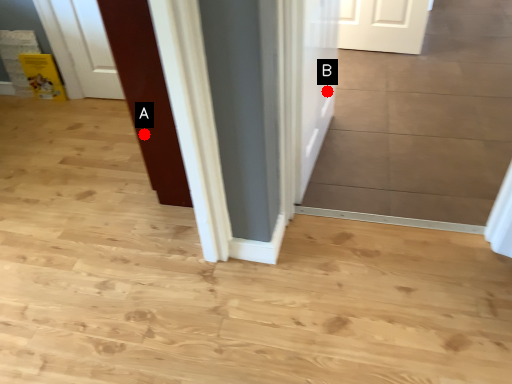
Question: Two points are circled on the image, labeled by A and B beside each circle. Which of the following is the closest to the observer?

Choices:
 (A) A is closer
 (B) B is closer

Answer: (A)